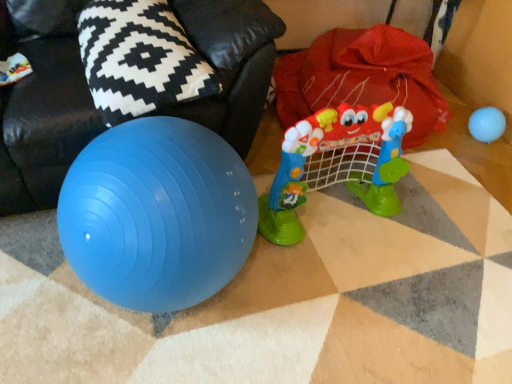
Where is `vacant area situated to the left side of blue rubber ball at upper right, positioned as the second toy in left-to-right order`? This screenshot has width=512, height=384. vacant area situated to the left side of blue rubber ball at upper right, positioned as the second toy in left-to-right order is located at coordinates (452, 140).